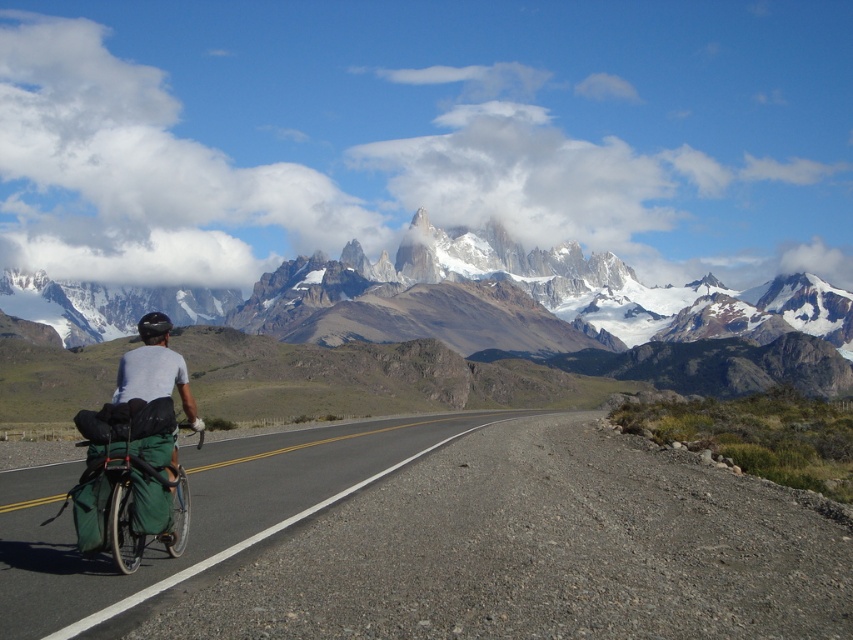
Does snowy granite mountain range at center have a greater width compared to green fabric bag at left?

Correct, the width of snowy granite mountain range at center exceeds that of green fabric bag at left.

Is snowy granite mountain range at center positioned behind green fabric bag at left?

Yes, snowy granite mountain range at center is behind green fabric bag at left.

I want to click on snowy granite mountain range at center, so click(x=463, y=301).

Is snowy granite mountain range at center to the left of gray fabric helmet at left from the viewer's perspective?

Correct, you'll find snowy granite mountain range at center to the left of gray fabric helmet at left.

Between point (699, 317) and point (131, 376), which one is positioned behind?

Point (699, 317)

The height and width of the screenshot is (640, 853). What are the coordinates of `snowy granite mountain range at center` in the screenshot? It's located at (463, 301).

Is snowy granite mountain range at center shorter than black asphalt road at center?

No, snowy granite mountain range at center is not shorter than black asphalt road at center.

Is snowy granite mountain range at center closer to the viewer compared to black asphalt road at center?

No, it is not.

Locate an element on the screen. snowy granite mountain range at center is located at coordinates (463, 301).